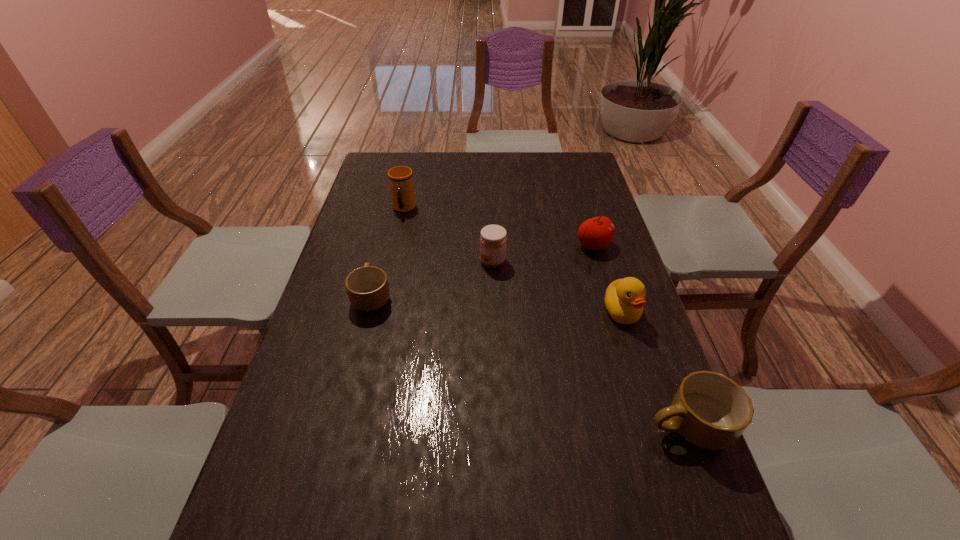
This screenshot has height=540, width=960. I want to click on vacant region between the shorter mug and the duck, so click(497, 304).

Locate an element on the screen. The width and height of the screenshot is (960, 540). free space between the taller mug and the duck is located at coordinates (655, 369).

Find the location of a particular element. free space between the farthest object and the fourth object from right to left is located at coordinates (448, 235).

Where is `vacant point located between the apple and the duck`? vacant point located between the apple and the duck is located at coordinates (608, 279).

What are the coordinates of `empty space that is in between the nearest object and the duck` in the screenshot? It's located at (655, 369).

You are a GUI agent. You are given a task and a screenshot of the screen. Output one action in this format:
    pyautogui.click(x=<x>, y=<y>)
    Task: Click on the vacant area that lies between the duck and the jam
    
    Given the screenshot: What is the action you would take?
    pyautogui.click(x=557, y=287)

At what (x,y) coordinates should I click in order to perform the action: click on free spot between the duck and the nearer mug. Please return your answer as a coordinate pair (x, y). Image resolution: width=960 pixels, height=540 pixels. Looking at the image, I should click on (655, 369).

Find the location of a particular element. The image size is (960, 540). free spot between the farthest object and the nearer mug is located at coordinates (546, 318).

Locate an element on the screen. free space between the apple and the duck is located at coordinates (608, 279).

Select which object is the closest to the cup. Please provide its 2D coordinates. Your answer should be formatted as a tuple, i.e. [(x, y)], where the tuple contains the x and y coordinates of a point satisfying the conditions above.

[(493, 241)]